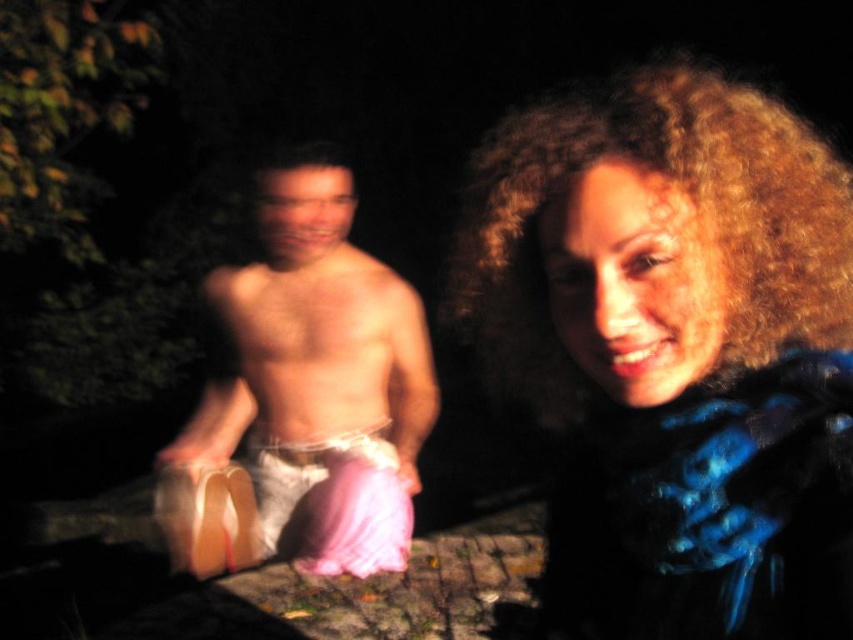
In the scene shown: Who is lower down, curly blonde hair at right or pink fabric at left?

Positioned lower is pink fabric at left.

Is curly blonde hair at right below pink fabric at left?

No, curly blonde hair at right is not below pink fabric at left.

Which is behind, point (535, 387) or point (390, 444)?

The point (390, 444) is behind.

Locate an element on the screen. The image size is (853, 640). curly blonde hair at right is located at coordinates (674, 352).

Can you confirm if pink fabric at left is positioned above pink satin underwear at lower left?

Yes, pink fabric at left is above pink satin underwear at lower left.

Between point (262, 248) and point (347, 509), which one is positioned behind?

Point (262, 248)

Find the location of `pink fabric at left`. pink fabric at left is located at coordinates (305, 394).

You are a GUI agent. You are given a task and a screenshot of the screen. Output one action in this format:
    pyautogui.click(x=<x>, y=<y>)
    Task: Click on the curly blonde hair at right
    The width and height of the screenshot is (853, 640).
    Given the screenshot: What is the action you would take?
    pyautogui.click(x=674, y=352)

Does curly blonde hair at right have a lesser width compared to pink satin underwear at lower left?

Yes.

Does point (659, 152) come farther from viewer compared to point (201, 520)?

No, it is in front of (201, 520).

Where is `curly blonde hair at right`? The width and height of the screenshot is (853, 640). curly blonde hair at right is located at coordinates (674, 352).